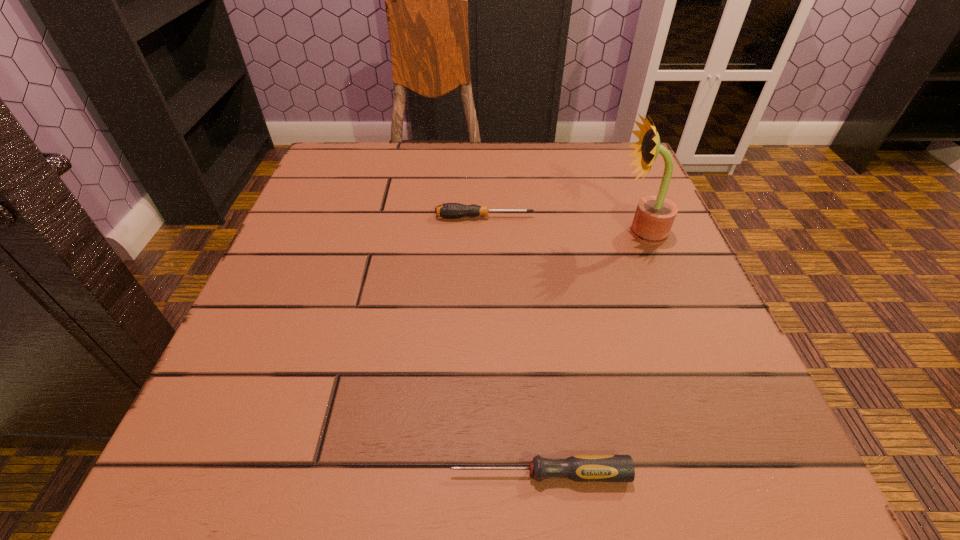
At what (x,y) coordinates should I click in order to perform the action: click on vacant space located insert the nearest object into a screw head. Please return your answer as a coordinate pair (x, y). The height and width of the screenshot is (540, 960). Looking at the image, I should click on (259, 474).

Where is `object that is at the near edge`? The image size is (960, 540). object that is at the near edge is located at coordinates (581, 468).

At what (x,y) coordinates should I click in order to perform the action: click on object located at the right edge. Please return your answer as a coordinate pair (x, y). This screenshot has height=540, width=960. Looking at the image, I should click on (654, 216).

In the image, there is a desktop. Identify the location of free space at the far edge. The image size is (960, 540). pyautogui.click(x=508, y=171).

Image resolution: width=960 pixels, height=540 pixels. I want to click on free region at the near edge of the desktop, so click(x=509, y=474).

In the image, there is a desktop. Where is `vacant area at the left edge`? This screenshot has height=540, width=960. vacant area at the left edge is located at coordinates (337, 210).

Locate an element on the screen. This screenshot has height=540, width=960. free location at the right edge of the desktop is located at coordinates (636, 257).

The height and width of the screenshot is (540, 960). Identify the location of free space at the far left corner of the desktop. (372, 199).

In the image, there is a desktop. Identify the location of vacant space at the far right corner. (596, 169).

Locate an element on the screen. The width and height of the screenshot is (960, 540). vacant area that lies between the farther screwdriver and the nearer screwdriver is located at coordinates (512, 345).